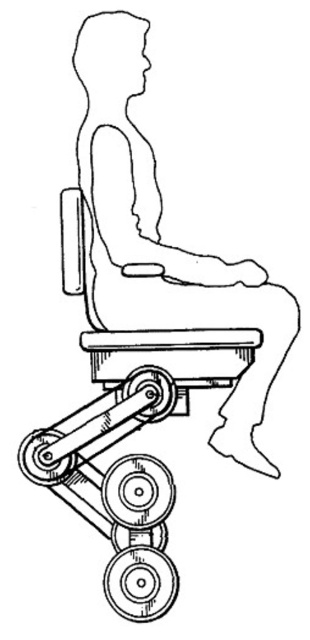
Is black line drawing of person at center above matte plastic chair at center?

Indeed, black line drawing of person at center is positioned over matte plastic chair at center.

In the scene shown: Is black line drawing of person at center smaller than matte plastic chair at center?

Actually, black line drawing of person at center might be larger than matte plastic chair at center.

What do you see at coordinates (160, 241) in the screenshot?
I see `black line drawing of person at center` at bounding box center [160, 241].

What are the coordinates of `black line drawing of person at center` in the screenshot? It's located at (160, 241).